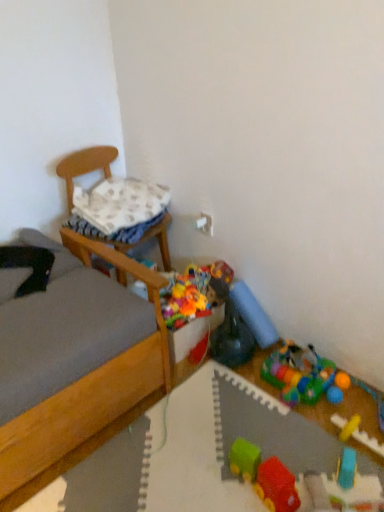
This screenshot has height=512, width=384. I want to click on vacant space in between rubber duck at center, the second toy positioned from the back, and blue rubber toy at lower right, which is the 3th toy from front to back, so click(x=287, y=413).